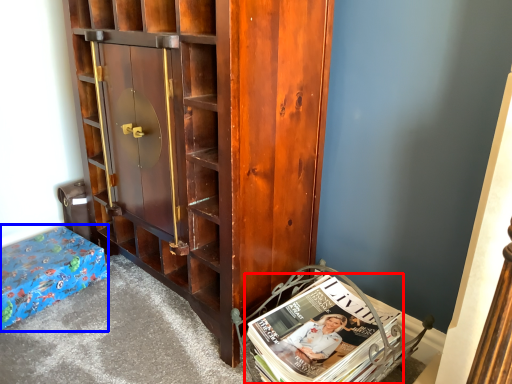
Question: Which of the following is the farthest to the observer, book (highlighted by a red box) or furniture (highlighted by a blue box)?

Choices:
 (A) book
 (B) furniture

Answer: (B)